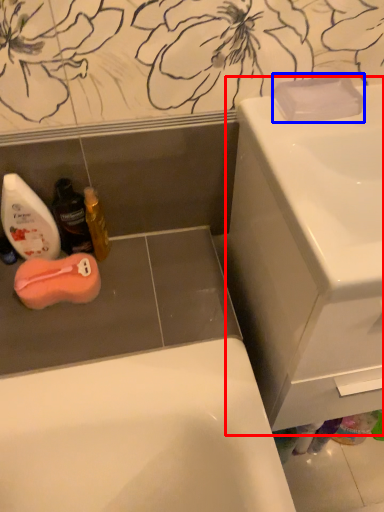
Question: Which of the following is the farthest to the observer, sink (highlighted by a red box) or soap (highlighted by a blue box)?

Choices:
 (A) sink
 (B) soap

Answer: (B)